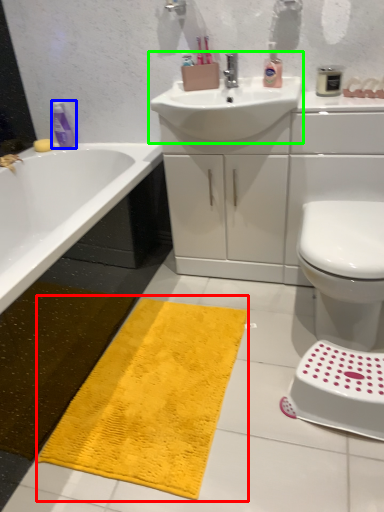
Question: Estimate the real-world distances between objects in this image. Which object is closer to bath mat (highlighted by a red box), mouthwash (highlighted by a blue box) or sink (highlighted by a green box)?

Choices:
 (A) mouthwash
 (B) sink

Answer: (B)